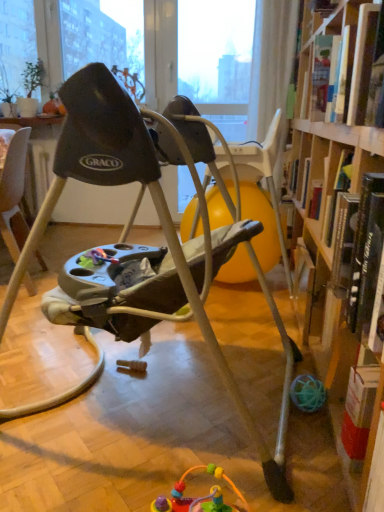
Question: From a real-world perspective, is hardcover book at upper right, which ranks as the 2th book in bottom-to-top order, located beneath hardcover book at right, which appears as the second book when viewed from the top?

Choices:
 (A) no
 (B) yes

Answer: (A)

Question: Can you see hardcover book at upper right, which ranks as the 1th book in top-to-bottom order, touching hardcover book at right, which appears as the second book when viewed from the top?

Choices:
 (A) no
 (B) yes

Answer: (A)

Question: Is hardcover book at upper right, which ranks as the 1th book in top-to-bottom order, behind hardcover book at right, which is counted as the first book, starting from the bottom?

Choices:
 (A) yes
 (B) no

Answer: (A)

Question: Is hardcover book at upper right, which ranks as the 1th book in top-to-bottom order, located outside hardcover book at right, which is counted as the first book, starting from the bottom?

Choices:
 (A) yes
 (B) no

Answer: (A)

Question: Does hardcover book at upper right, which ranks as the 2th book in bottom-to-top order, have a greater height compared to hardcover book at right, which appears as the second book when viewed from the top?

Choices:
 (A) no
 (B) yes

Answer: (A)

Question: Is hardcover book at upper right, which ranks as the 2th book in bottom-to-top order, positioned before hardcover book at right, which is counted as the first book, starting from the bottom?

Choices:
 (A) yes
 (B) no

Answer: (B)

Question: Is gray plastic baby swing at center positioned behind hardcover book at right, which is counted as the first book, starting from the bottom?

Choices:
 (A) no
 (B) yes

Answer: (A)

Question: Is gray plastic baby swing at center touching hardcover book at right, which is counted as the first book, starting from the bottom?

Choices:
 (A) yes
 (B) no

Answer: (B)

Question: Is gray plastic baby swing at center looking in the opposite direction of hardcover book at right, which is counted as the first book, starting from the bottom?

Choices:
 (A) no
 (B) yes

Answer: (B)

Question: Is gray plastic baby swing at center positioned in front of hardcover book at right, which appears as the second book when viewed from the top?

Choices:
 (A) yes
 (B) no

Answer: (A)

Question: Can you confirm if gray plastic baby swing at center is wider than hardcover book at right, which appears as the second book when viewed from the top?

Choices:
 (A) yes
 (B) no

Answer: (A)

Question: From a real-world perspective, is gray plastic baby swing at center positioned over hardcover book at right, which is counted as the first book, starting from the bottom, based on gravity?

Choices:
 (A) yes
 (B) no

Answer: (B)

Question: Does hardcover book at right, which is counted as the first book, starting from the bottom, have a lesser height compared to hardcover book at upper right, which ranks as the 2th book in bottom-to-top order?

Choices:
 (A) yes
 (B) no

Answer: (B)